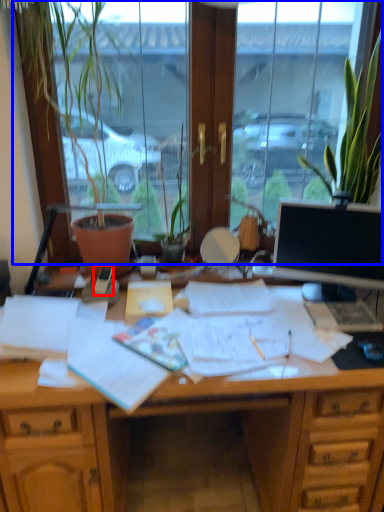
Question: Which object is further to the camera taking this photo, mobile phone (highlighted by a red box) or window (highlighted by a blue box)?

Choices:
 (A) mobile phone
 (B) window

Answer: (A)